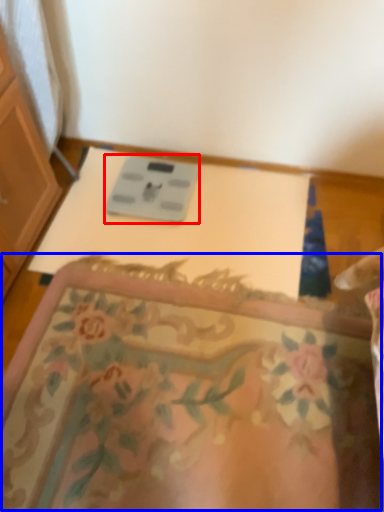
Question: Which point is further to the camera, scale (highlighted by a red box) or mat (highlighted by a blue box)?

Choices:
 (A) scale
 (B) mat

Answer: (A)